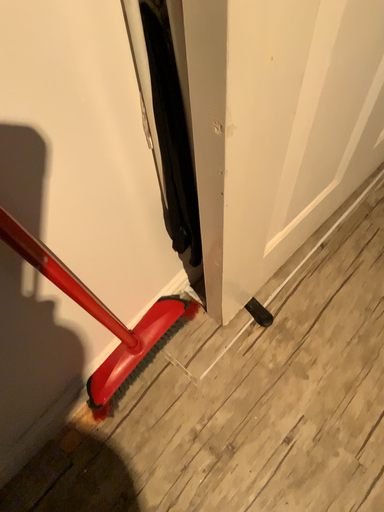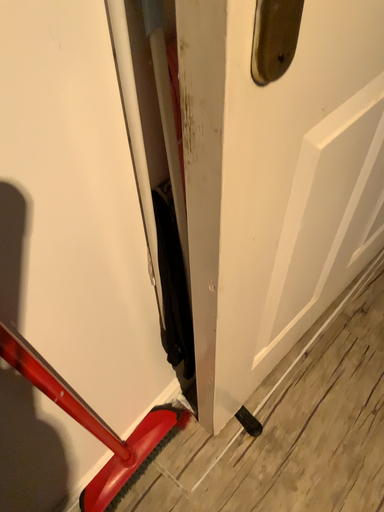
Question: Which way did the camera rotate in the video?

Choices:
 (A) rotated downward
 (B) rotated upward

Answer: (B)